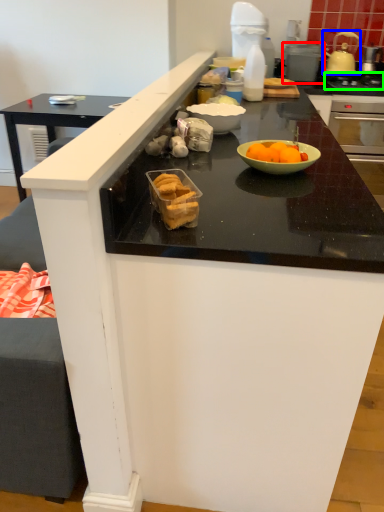
Question: Considering the real-world distances, which object is closest to appliance (highlighted by a red box)? kitchen appliance (highlighted by a blue box) or gas stove (highlighted by a green box).

Choices:
 (A) kitchen appliance
 (B) gas stove

Answer: (A)